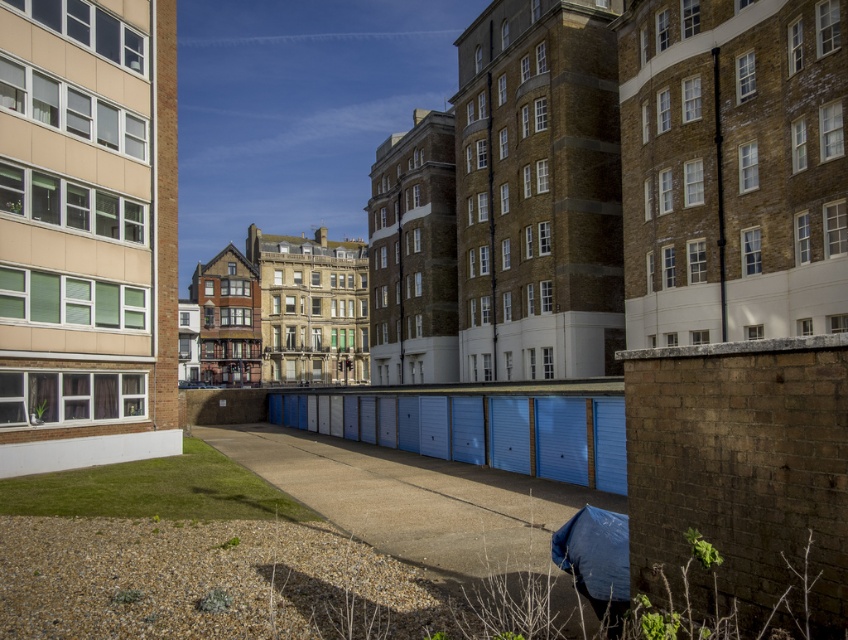
Can you confirm if smooth concrete pavement at center is positioned above blue fabric umbrella at lower right?

Incorrect, smooth concrete pavement at center is not positioned above blue fabric umbrella at lower right.

Does point (503, 529) lie in front of point (584, 554)?

No, it is not.

The image size is (848, 640). Identify the location of smooth concrete pavement at center. (411, 497).

Where is `smooth concrete pavement at center`? The width and height of the screenshot is (848, 640). smooth concrete pavement at center is located at coordinates (411, 497).